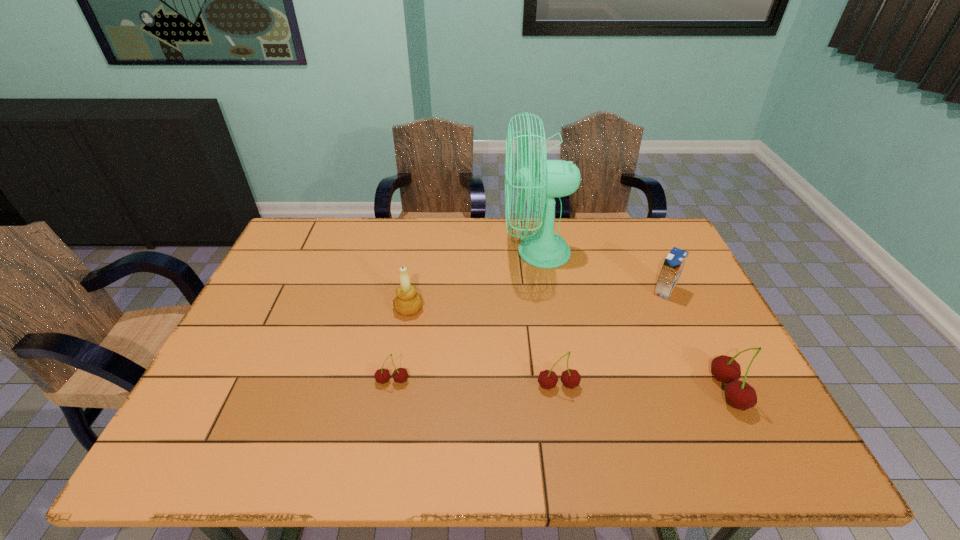
Locate an element on the screen. The image size is (960, 540). cherry object that ranks as the second closest to the orange_juice is located at coordinates (570, 378).

The image size is (960, 540). Identify the location of vacant area in the image that satisfies the following two spatial constraints: 1. in front of the orange_juice to blow air; 2. on the right side of the tallest object. (542, 291).

The width and height of the screenshot is (960, 540). What are the coordinates of `free space in the image that satisfies the following two spatial constraints: 1. in front of the fan to blow air; 2. on the surface of the shortest cherry` in the screenshot? It's located at (556, 381).

Locate an element on the screen. free space that satisfies the following two spatial constraints: 1. in front of the fan to blow air; 2. on the left side of the orange_juice is located at coordinates (542, 291).

Where is `vacant space that satisfies the following two spatial constraints: 1. in front of the fan to blow air; 2. on the surface of the shortest cherry`? vacant space that satisfies the following two spatial constraints: 1. in front of the fan to blow air; 2. on the surface of the shortest cherry is located at coordinates (556, 381).

Locate an element on the screen. The height and width of the screenshot is (540, 960). free point that satisfies the following two spatial constraints: 1. in front of the orange_juice to blow air; 2. on the right side of the fan is located at coordinates (542, 291).